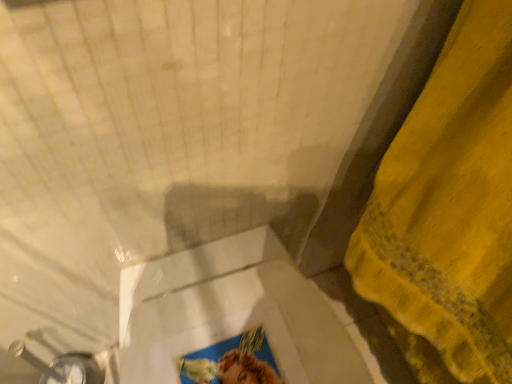
Question: Should I look upward or downward to see yellow fabric at right?

Choices:
 (A) up
 (B) down

Answer: (B)